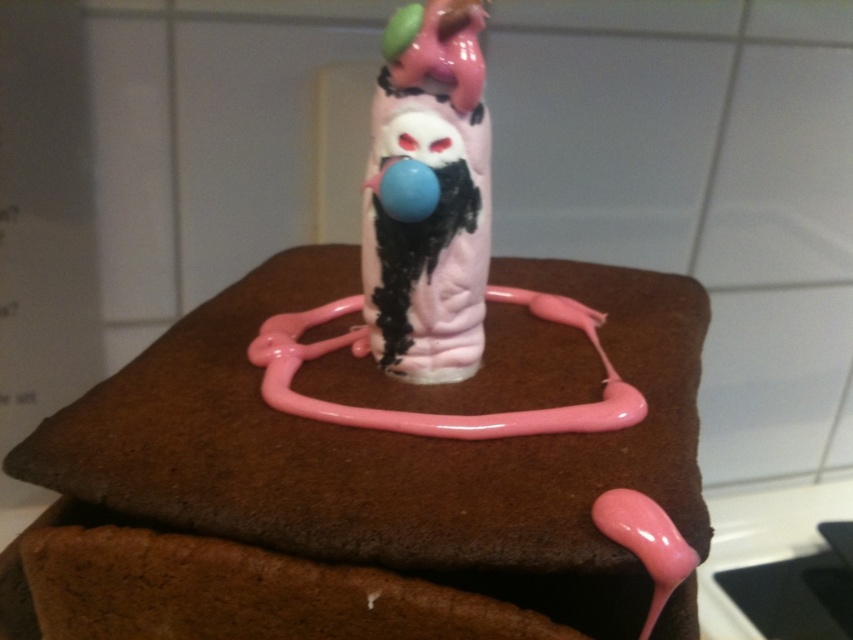
Question: Is matte plastic toy at center above matte pink plastic figurine at center?

Choices:
 (A) no
 (B) yes

Answer: (A)

Question: Is matte plastic toy at center bigger than matte pink plastic figurine at center?

Choices:
 (A) yes
 (B) no

Answer: (A)

Question: Which object appears farthest from the camera in this image?

Choices:
 (A) matte plastic toy at center
 (B) matte pink plastic figurine at center

Answer: (A)

Question: Can you confirm if matte plastic toy at center is wider than matte pink plastic figurine at center?

Choices:
 (A) yes
 (B) no

Answer: (A)